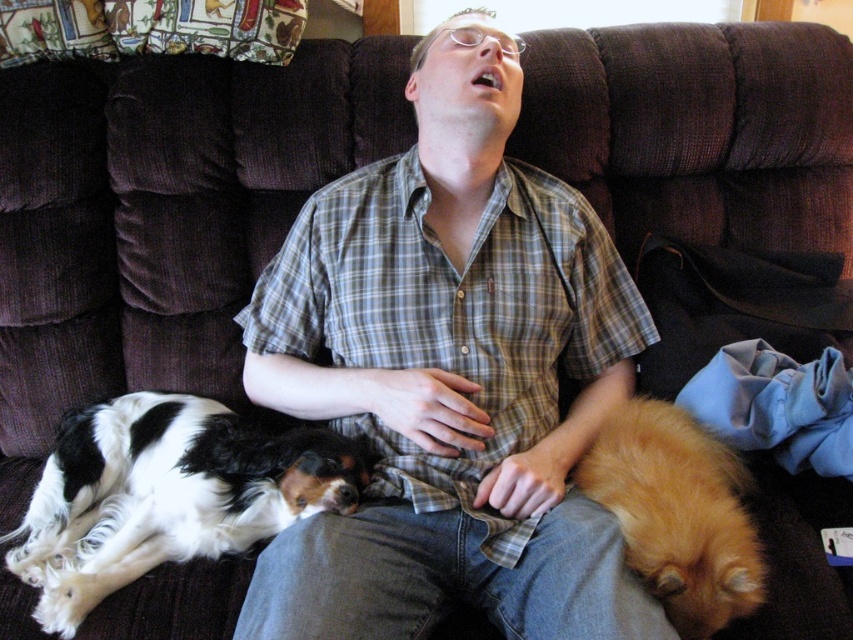
You are a photographer setting up a shoot in this living room. You need to place a 1.2 meter wide backdrop behind the black and white fur at left and the fuzzy golden dog at lower right. Which animal requires the wider space between them to accommodate their size?

The black and white fur at left requires the wider space between them because its width surpasses that of the fuzzy golden dog at lower right.